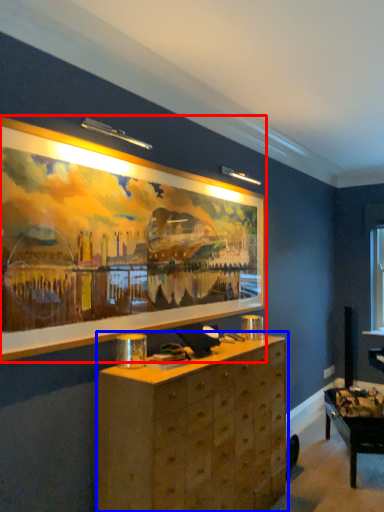
Question: Which object appears farthest to the camera in this image, picture frame (highlighted by a red box) or chest of drawers (highlighted by a blue box)?

Choices:
 (A) picture frame
 (B) chest of drawers

Answer: (B)